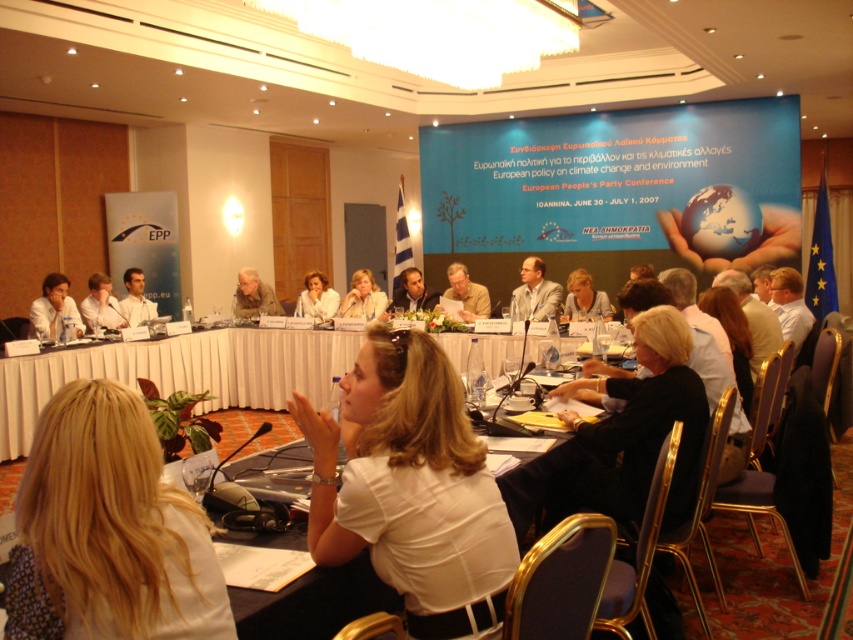
You are attending the European People Party Conference and notice two people in the foreground. One is wearing a white matte shirt at center and another has blonde hair at lower left. From your perspective, which person appears taller?

The white matte shirt at center appears taller than the blonde hair at lower left because the white matte shirt at center has a greater height compared to blonde hair at lower left.

You are a photographer at the conference and need to position a backdrop for a group photo. The backdrop is designed to fit the widest person in the front row. You notice two individuals in the front row wearing a white matte shirt at center and a matte white blouse at center. Which clothing item should the backdrop be sized for to ensure it accommodates the widest individual?

The white matte shirt at center has a greater width than the matte white blouse at center, so the backdrop should be sized for the white matte shirt at center to accommodate the widest individual.